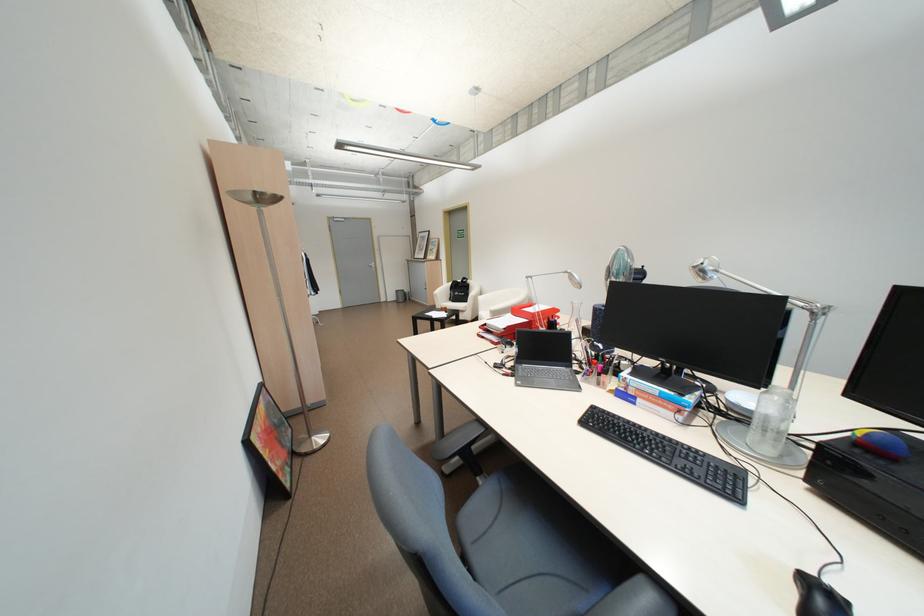
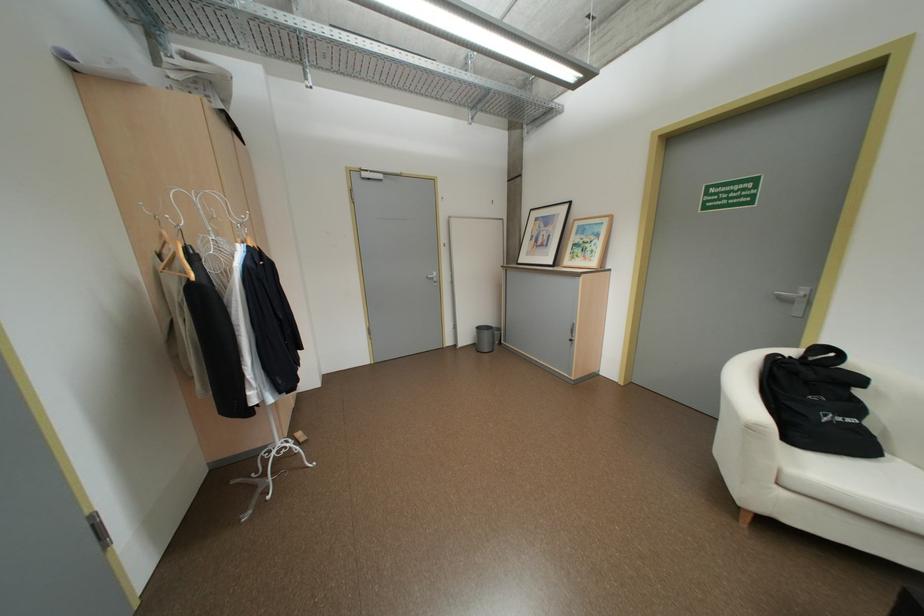
The point at (402, 296) is marked in the first image. Where is the corresponding point in the second image?

(476, 338)